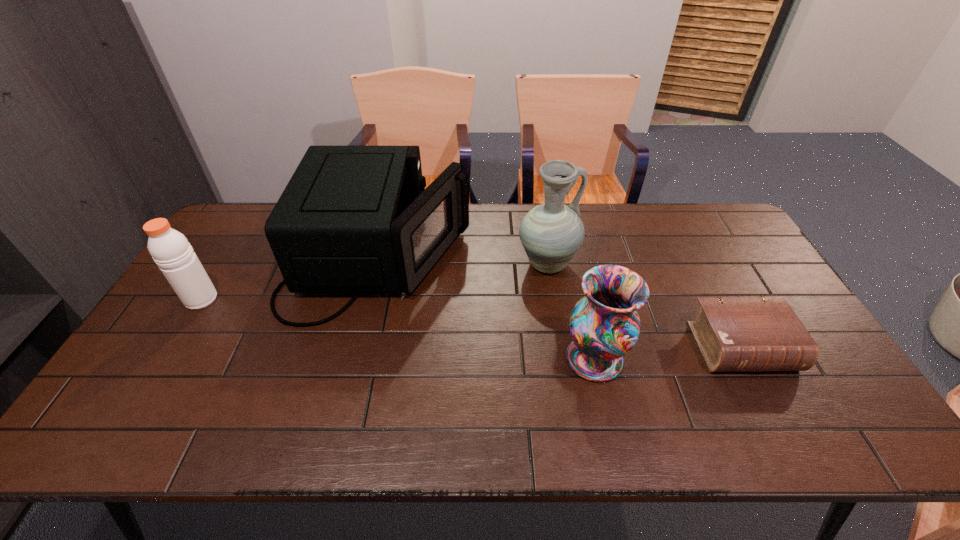
This screenshot has width=960, height=540. What are the coordinates of `free spot between the vase and the rightmost object` in the screenshot? It's located at (668, 353).

Locate an element on the screen. This screenshot has width=960, height=540. free space between the shortest object and the vase is located at coordinates (668, 353).

You are a GUI agent. You are given a task and a screenshot of the screen. Output one action in this format:
    pyautogui.click(x=<x>, y=<y>)
    Task: Click on the free space between the pitcher and the second object from left to right
    Image resolution: width=960 pixels, height=540 pixels.
    Given the screenshot: What is the action you would take?
    pyautogui.click(x=464, y=261)

You are a GUI agent. You are given a task and a screenshot of the screen. Output one action in this format:
    pyautogui.click(x=<x>, y=<y>)
    Task: Click on the vacant point located between the vase and the pitcher
    The image size is (960, 540).
    Given the screenshot: What is the action you would take?
    pyautogui.click(x=571, y=312)

Where is `vacant area that lies between the shortest object and the microwave oven`? The image size is (960, 540). vacant area that lies between the shortest object and the microwave oven is located at coordinates (561, 302).

Identify the location of unoccupied position between the second object from left to right and the Bible. The height and width of the screenshot is (540, 960). (561, 302).

Find the location of `free spot between the microwave oven and the vase`. free spot between the microwave oven and the vase is located at coordinates (487, 308).

Identify the location of free space that is in between the tallest object and the vase. (571, 312).

The image size is (960, 540). Identify the location of the third closest object relative to the shaker. (604, 325).

Identify which object is the second nearest to the microwave oven. Please provide its 2D coordinates. Your answer should be formatted as a tuple, i.e. [(x, y)], where the tuple contains the x and y coordinates of a point satisfying the conditions above.

[(173, 254)]